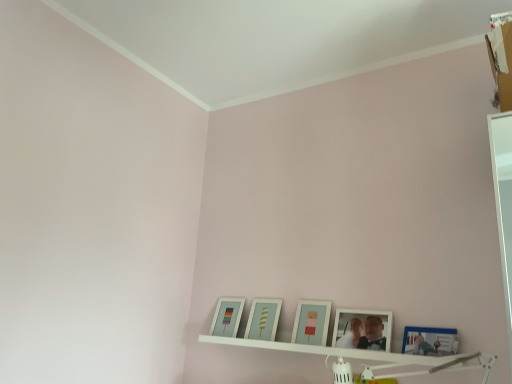
Question: In terms of width, does matte glass picture frame at lower left, the 1th picture frame in the left-to-right sequence, look wider or thinner when compared to blue glossy picture frame at lower right, which is the 1th picture frame in right-to-left order?

Choices:
 (A) wide
 (B) thin

Answer: (A)

Question: From a real-world perspective, is matte glass picture frame at lower left, which is counted as the 5th picture frame, starting from the right, positioned above or below blue glossy picture frame at lower right, which is the 1th picture frame in right-to-left order?

Choices:
 (A) above
 (B) below

Answer: (A)

Question: Which object is the closest to the blue glossy picture frame at lower right, which is the 1th picture frame in right-to-left order?

Choices:
 (A) matte white picture frame at center, which is the second picture frame from left to right
 (B) matte blue picture frame at center, marked as the 3th picture frame in a left-to-right arrangement
 (C) white matte picture frame at lower center, placed as the second picture frame when sorted from right to left
 (D) matte glass picture frame at lower left, which is counted as the 5th picture frame, starting from the right
 (E) white wooden shelf at lower center

Answer: (C)

Question: Estimate the real-world distances between objects in this image. Which object is closer to the white matte picture frame at lower center, placed as the second picture frame when sorted from right to left?

Choices:
 (A) white wooden shelf at lower center
 (B) matte blue picture frame at center, marked as the 3th picture frame in a left-to-right arrangement
 (C) matte white picture frame at center, placed as the fourth picture frame when sorted from right to left
 (D) matte glass picture frame at lower left, the 1th picture frame in the left-to-right sequence
 (E) blue glossy picture frame at lower right, which is the 1th picture frame in right-to-left order

Answer: (A)